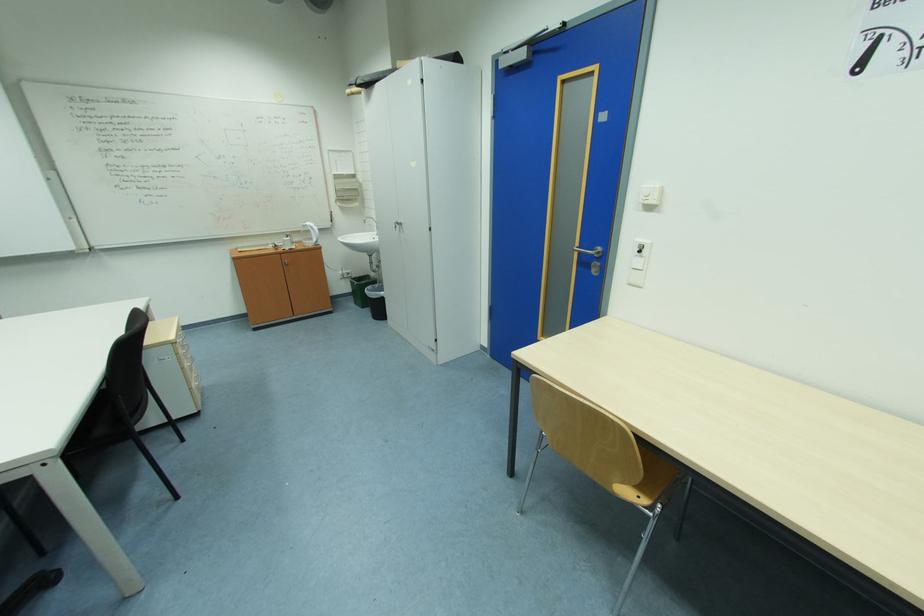
The height and width of the screenshot is (616, 924). Describe the element at coordinates (101, 413) in the screenshot. I see `the black chair sitting surface` at that location.